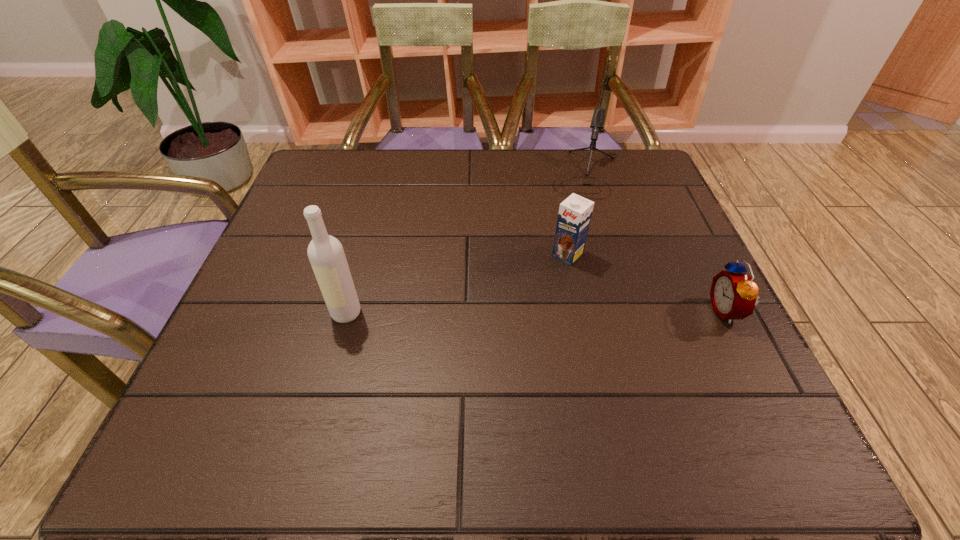
At what (x,y) coordinates should I click in order to perform the action: click on free space at the near edge. Please return your answer as a coordinate pair (x, y). Looking at the image, I should click on (318, 386).

At what (x,y) coordinates should I click in order to perform the action: click on vacant area at the left edge of the desktop. Please return your answer as a coordinate pair (x, y). The width and height of the screenshot is (960, 540). Looking at the image, I should click on (321, 306).

At what (x,y) coordinates should I click in order to perform the action: click on free point at the right edge. Please return your answer as a coordinate pair (x, y). The image size is (960, 540). Looking at the image, I should click on (682, 287).

Where is `vacant region at the far left corner of the desktop`? This screenshot has height=540, width=960. vacant region at the far left corner of the desktop is located at coordinates (332, 176).

The width and height of the screenshot is (960, 540). I want to click on free space at the near left corner of the desktop, so click(206, 405).

The width and height of the screenshot is (960, 540). Identify the location of vacant space at the far right corner of the desktop. (x=608, y=173).

Where is `vacant region between the rightmost object and the chocolate milk`? vacant region between the rightmost object and the chocolate milk is located at coordinates (647, 283).

You are a GUI agent. You are given a task and a screenshot of the screen. Output one action in this format:
    pyautogui.click(x=<x>, y=<y>)
    Task: Click on the unoccupied position between the chocolate milk and the tallest object
    The image size is (960, 540).
    Given the screenshot: What is the action you would take?
    pyautogui.click(x=457, y=284)

At what (x,y) coordinates should I click in order to perform the action: click on empty location between the alarm clock and the tallest object. Please return your answer as a coordinate pair (x, y). This screenshot has width=960, height=540. Looking at the image, I should click on coord(537,312).

Where is `free area in between the alarm clock and the chocolate milk`? The width and height of the screenshot is (960, 540). free area in between the alarm clock and the chocolate milk is located at coordinates pyautogui.click(x=647, y=283).